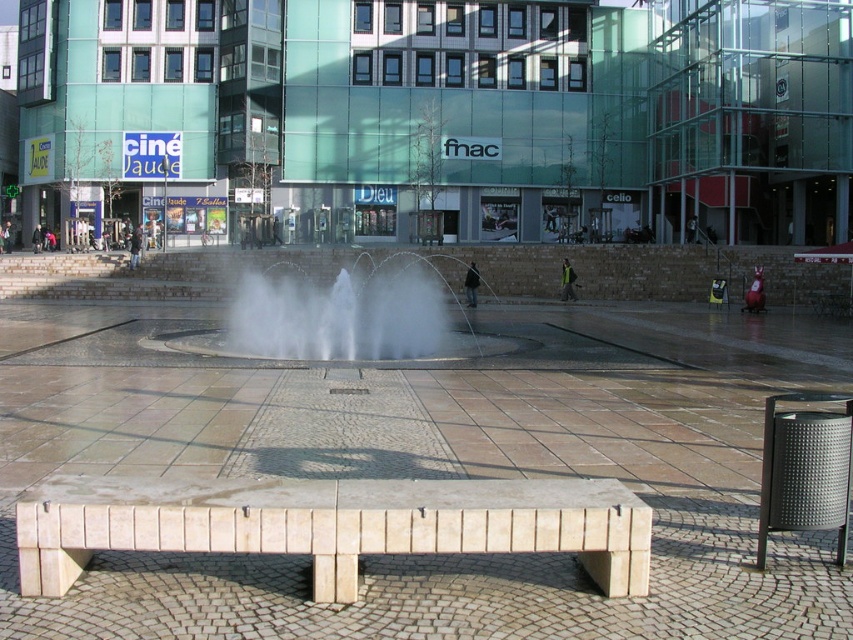
You are standing in the plaza and want to take a photo of the green glass building at upper center without the white stone bench at center blocking the view. Is it possible?

The green glass building at upper center is closer to you than the white stone bench at center, so you can take a photo of the green glass building at upper center without the white stone bench at center blocking the view.